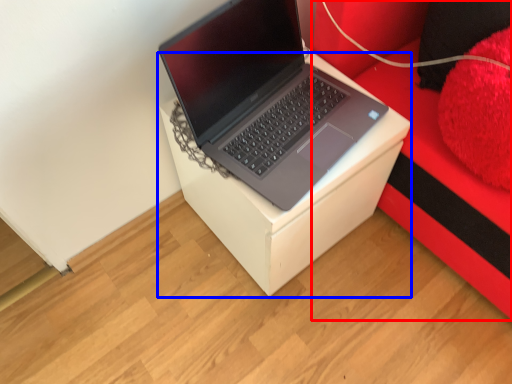
Question: Which of the following is the closest to the observer, furniture (highlighted by a red box) or table (highlighted by a blue box)?

Choices:
 (A) furniture
 (B) table

Answer: (A)